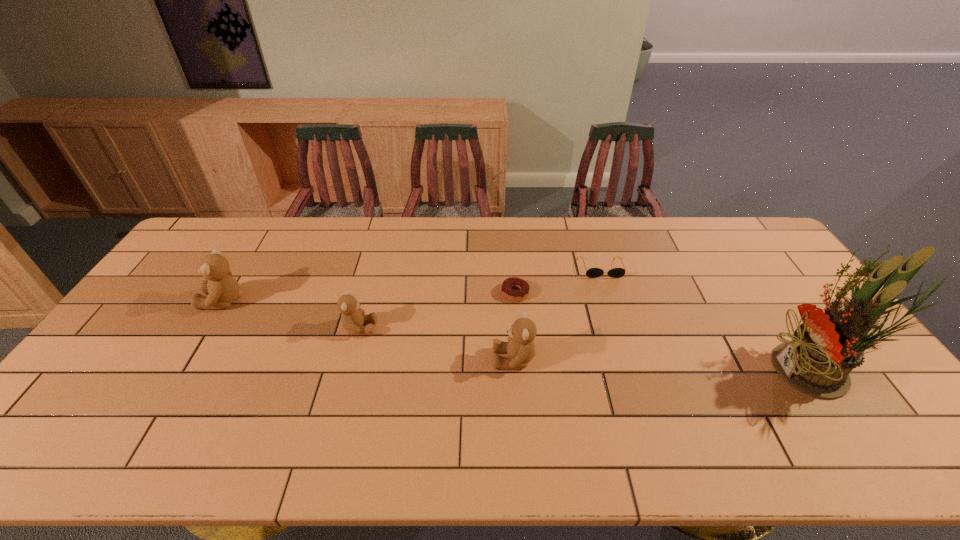
Image resolution: width=960 pixels, height=540 pixels. Find the location of `blank space that satisfies the following two spatial constraints: 1. on the front-facing side of the sunglasses; 2. on the front-facing side of the second nearest teddy bear`. blank space that satisfies the following two spatial constraints: 1. on the front-facing side of the sunglasses; 2. on the front-facing side of the second nearest teddy bear is located at coordinates (620, 328).

Identify the location of blank space that satisfies the following two spatial constraints: 1. on the front-facing side of the fifth tallest object; 2. on the front-facing side of the second shortest teddy bear. (630, 360).

I want to click on free location that satisfies the following two spatial constraints: 1. on the front-facing side of the sunglasses; 2. on the front-facing side of the farthest teddy bear, so click(x=612, y=301).